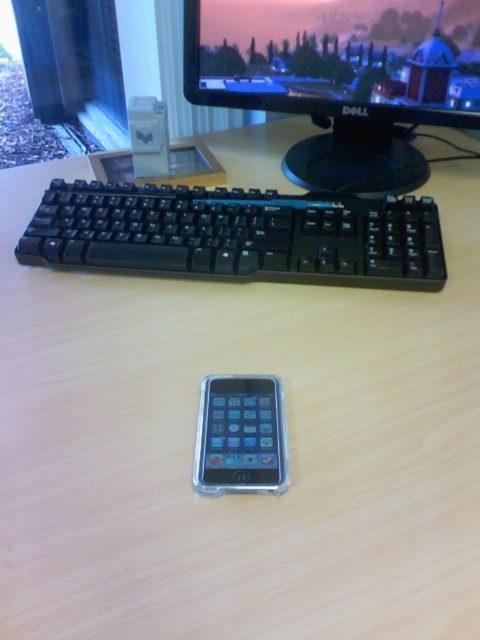
Question: Can you confirm if black plastic monitor at upper center is thinner than silver metallic smartphone at center?

Choices:
 (A) yes
 (B) no

Answer: (B)

Question: Among these points, which one is nearest to the camera?

Choices:
 (A) (362, 230)
 (B) (345, 22)
 (C) (218, 451)

Answer: (C)

Question: Which object is closer to the camera taking this photo?

Choices:
 (A) silver metallic smartphone at center
 (B) black plastic keyboard at upper center

Answer: (A)

Question: Can you confirm if black plastic monitor at upper center is wider than black plastic keyboard at upper center?

Choices:
 (A) yes
 (B) no

Answer: (B)

Question: Can you confirm if black plastic keyboard at upper center is smaller than silver metallic smartphone at center?

Choices:
 (A) yes
 (B) no

Answer: (B)

Question: Which point is farther to the camera?

Choices:
 (A) (257, 426)
 (B) (158, 241)

Answer: (B)